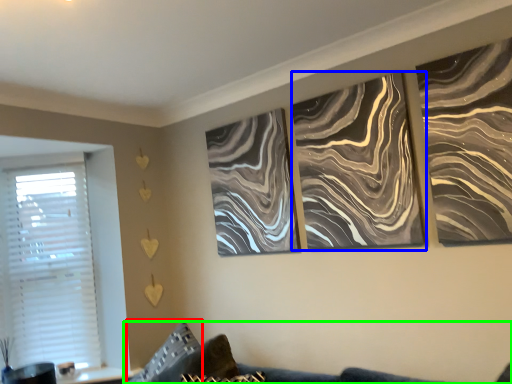
Question: Estimate the real-world distances between objects in this image. Which object is closer to pillow (highlighted by a red box), canvas (highlighted by a blue box) or couch (highlighted by a green box)?

Choices:
 (A) canvas
 (B) couch

Answer: (B)